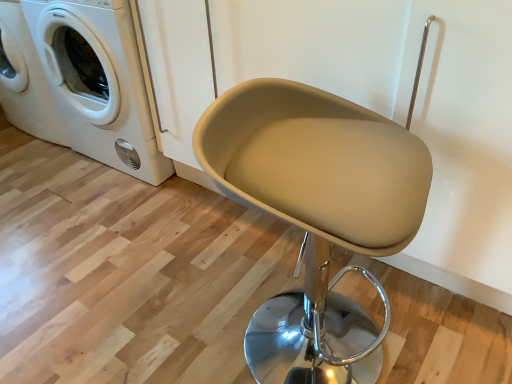
Where is `free space behind beige fabric swivel chair at center`? The image size is (512, 384). free space behind beige fabric swivel chair at center is located at coordinates (257, 260).